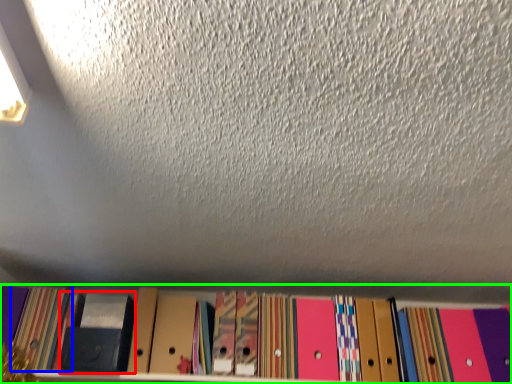
Question: Estimate the real-world distances between objects in this image. Which object is farther from paperback book (highlighted by a red box), paperback book (highlighted by a blue box) or shelf (highlighted by a green box)?

Choices:
 (A) paperback book
 (B) shelf

Answer: (B)